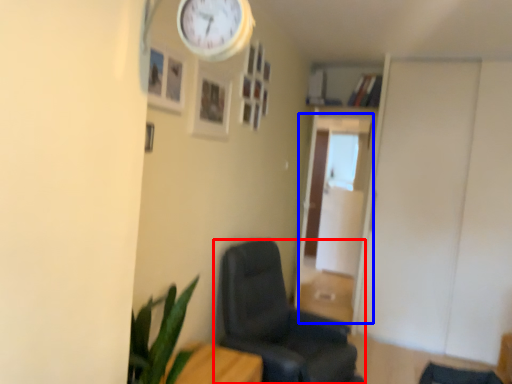
Question: Which object is further to the camera taking this photo, chair (highlighted by a red box) or glass door (highlighted by a blue box)?

Choices:
 (A) chair
 (B) glass door

Answer: (B)